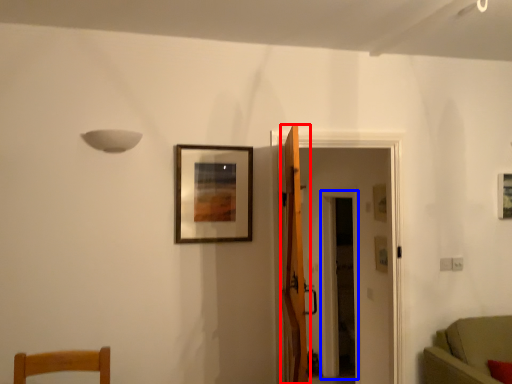
Question: Which object appears closest to the camera in this image, door (highlighted by a red box) or glass door (highlighted by a blue box)?

Choices:
 (A) door
 (B) glass door

Answer: (A)